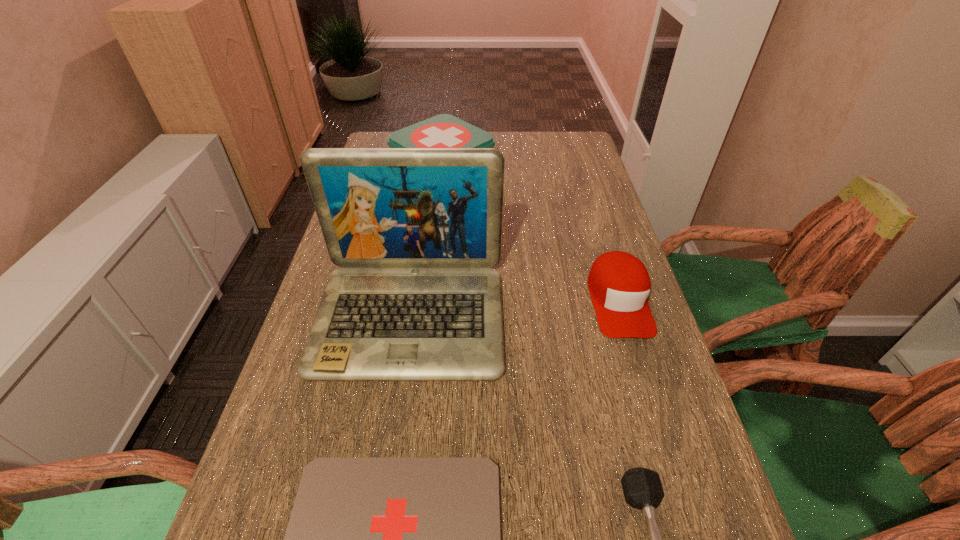
Locate an element on the screen. laptop computer is located at coordinates (415, 230).

Find the location of a particular element. the farthest object is located at coordinates (444, 130).

You are a GUI agent. You are given a task and a screenshot of the screen. Output one action in this format:
    pyautogui.click(x=<x>, y=<y>)
    Task: Click on the taller first-aid kit
    
    Given the screenshot: What is the action you would take?
    pyautogui.click(x=444, y=130)

This screenshot has width=960, height=540. What are the coordinates of `the third tallest object` in the screenshot? It's located at (619, 284).

Where is `vacant area situated on the screen of the tallest object`? The width and height of the screenshot is (960, 540). vacant area situated on the screen of the tallest object is located at coordinates (382, 511).

Locate an element on the screen. This screenshot has width=960, height=540. free space located 0.160m on the right of the farthest object is located at coordinates pos(541,168).

Where is `free space located on the front-facing side of the baseball cap`? The image size is (960, 540). free space located on the front-facing side of the baseball cap is located at coordinates point(648,397).

I want to click on object present at the far edge, so click(x=444, y=130).

Locate an element on the screen. laptop computer that is at the left edge is located at coordinates (415, 230).

Locate an element on the screen. This screenshot has width=960, height=540. the first-aid kit present at the left edge is located at coordinates (444, 130).